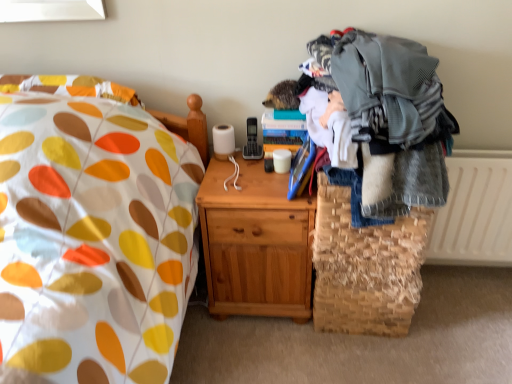
Question: Considering the relative positions of white textured radiator at right and woven straw basket at lower right in the image provided, is white textured radiator at right to the left of woven straw basket at lower right from the viewer's perspective?

Choices:
 (A) no
 (B) yes

Answer: (A)

Question: Is white textured radiator at right facing away from woven straw basket at lower right?

Choices:
 (A) yes
 (B) no

Answer: (B)

Question: Would you say white textured radiator at right contains woven straw basket at lower right?

Choices:
 (A) yes
 (B) no

Answer: (B)

Question: From the image's perspective, is white textured radiator at right on top of woven straw basket at lower right?

Choices:
 (A) no
 (B) yes

Answer: (B)

Question: Considering the relative positions of white textured radiator at right and woven straw basket at lower right in the image provided, is white textured radiator at right to the right of woven straw basket at lower right from the viewer's perspective?

Choices:
 (A) yes
 (B) no

Answer: (A)

Question: In terms of width, does white textured radiator at right look wider or thinner when compared to light brown wood nightstand at center?

Choices:
 (A) wide
 (B) thin

Answer: (B)

Question: In the image, is white textured radiator at right on the left side or the right side of light brown wood nightstand at center?

Choices:
 (A) left
 (B) right

Answer: (B)

Question: In terms of height, does white textured radiator at right look taller or shorter compared to light brown wood nightstand at center?

Choices:
 (A) tall
 (B) short

Answer: (B)

Question: From a real-world perspective, is white textured radiator at right physically located above or below light brown wood nightstand at center?

Choices:
 (A) above
 (B) below

Answer: (A)

Question: Is light brown wood nightstand at center in front of or behind white textured radiator at right in the image?

Choices:
 (A) front
 (B) behind

Answer: (A)

Question: Is light brown wood nightstand at center bigger or smaller than white textured radiator at right?

Choices:
 (A) big
 (B) small

Answer: (A)

Question: Is point (302, 243) positioned closer to the camera than point (483, 158)?

Choices:
 (A) farther
 (B) closer

Answer: (B)

Question: From the image's perspective, is light brown wood nightstand at center located above or below white textured radiator at right?

Choices:
 (A) above
 (B) below

Answer: (B)

Question: From a real-world perspective, relative to gray knitted sweater at right, is woven straw basket at lower right vertically above or below?

Choices:
 (A) below
 (B) above

Answer: (A)

Question: Looking at the image, does woven straw basket at lower right seem bigger or smaller compared to gray knitted sweater at right?

Choices:
 (A) small
 (B) big

Answer: (A)